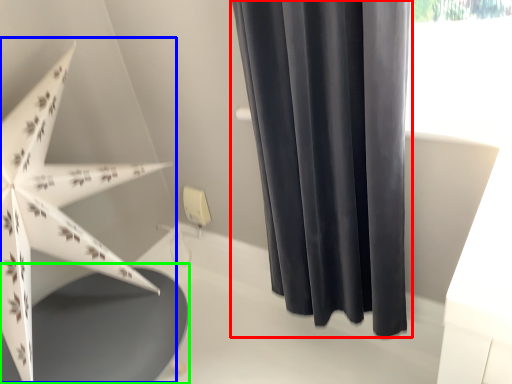
Question: Estimate the real-world distances between objects in this image. Which object is farther from curtain (highlighted by a red box), umbrella (highlighted by a blue box) or round table (highlighted by a green box)?

Choices:
 (A) umbrella
 (B) round table

Answer: (B)